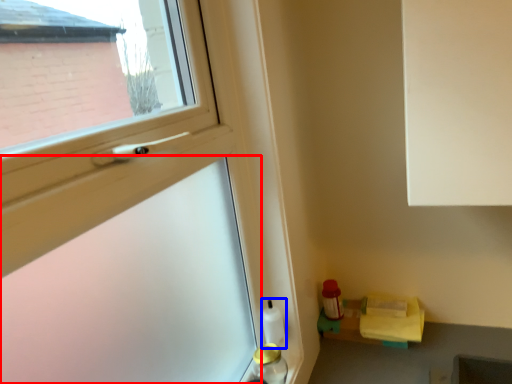
Question: Among these objects, which one is nearest to the camera, screen door (highlighted by a red box) or bottle (highlighted by a blue box)?

Choices:
 (A) screen door
 (B) bottle

Answer: (A)